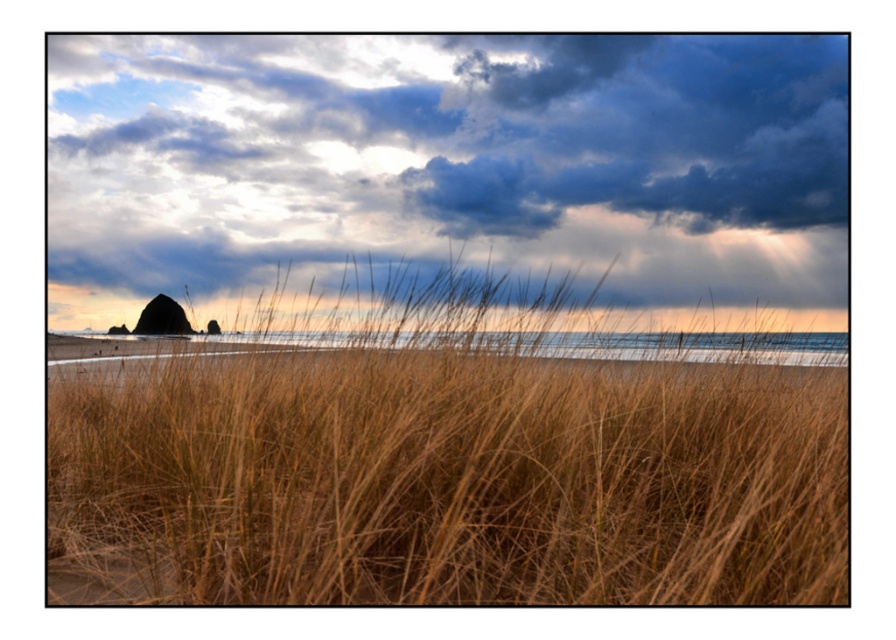
Question: Can you confirm if brown dry grass at center is positioned above dark blue textured cloud at upper center?

Choices:
 (A) yes
 (B) no

Answer: (B)

Question: Which point is farther from the camera taking this photo?

Choices:
 (A) (435, 600)
 (B) (247, 184)

Answer: (B)

Question: Is brown dry grass at center smaller than dark blue textured cloud at upper center?

Choices:
 (A) no
 (B) yes

Answer: (B)

Question: Can you confirm if brown dry grass at center is bigger than dark blue textured cloud at upper center?

Choices:
 (A) no
 (B) yes

Answer: (A)

Question: Which point is closer to the camera?

Choices:
 (A) (824, 237)
 (B) (237, 573)

Answer: (B)

Question: Among these objects, which one is farthest from the camera?

Choices:
 (A) dark blue textured cloud at upper center
 (B) brown dry grass at center

Answer: (A)